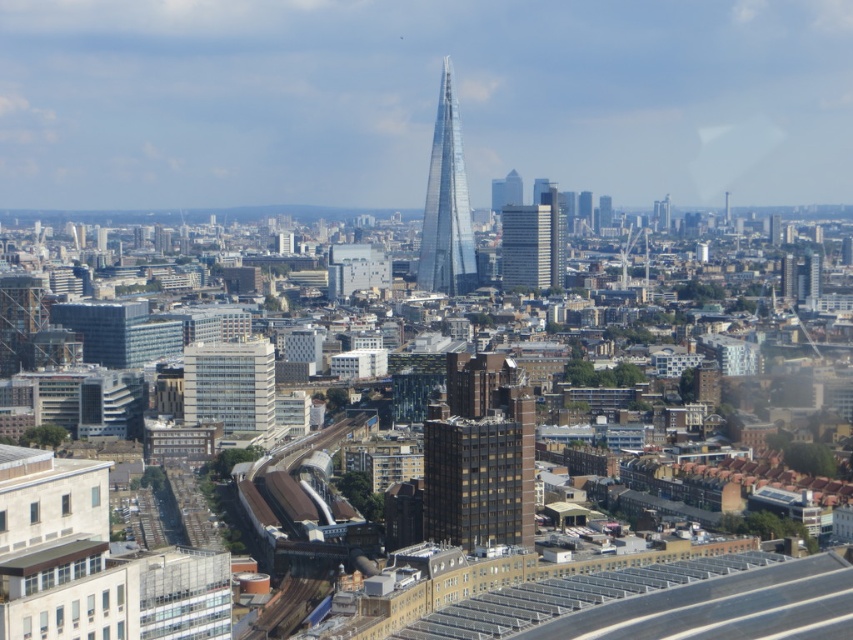
You are standing at the railway station and looking towards the city skyline. There are two points marked in the image, point 1 at coordinates point (438,182) and point 2 at coordinates point (247,348). Which point is closer to your current position?

Point (438,182) is further to the camera than point (247,348), so point (247,348) is closer to your current position.

You are a drone operator planning to fly a drone from the transparent glass tower at center to the white glass building at center. Given that the drone can only fly horizontally and must stay above the city buildings, which direction should you fly to ensure the drone doesn

The transparent glass tower at center is taller than the white glass building at center. Therefore, to ensure the drone stays above the city buildings during its horizontal flight, you should fly the drone towards the white glass building at center since it is shorter and the elevation difference will provide a safer path.